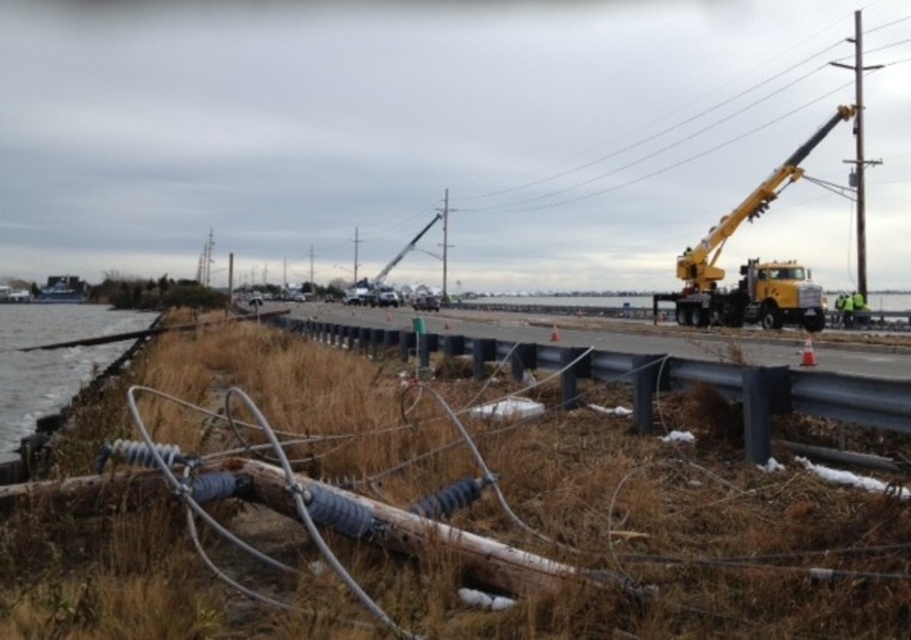
You are a repair crew member trying to assess the damage along the coastal road. You notice the black metal fence at center. Based on its position, can you determine if it is closer to the water or the utility poles?

The black metal fence at center is located at point (x=702, y=381), so it is closer to the water than the utility poles.

You are a construction worker assessing the damage along the coastal road. You notice a black metal fence at center near the point with coordinates (x=702, y=381). Is this fence intact or damaged?

The black metal fence at center located at point (x=702, y=381) is intact as there is no mention of damage in the scene description.

You are a road inspector assessing the damage after a storm. You notice the clear water at lower left and the metallic gray pole at center. Which object takes up more horizontal space in the image?

The clear water at lower left takes up more horizontal space than the metallic gray pole at center because its width surpasses that of the pole.